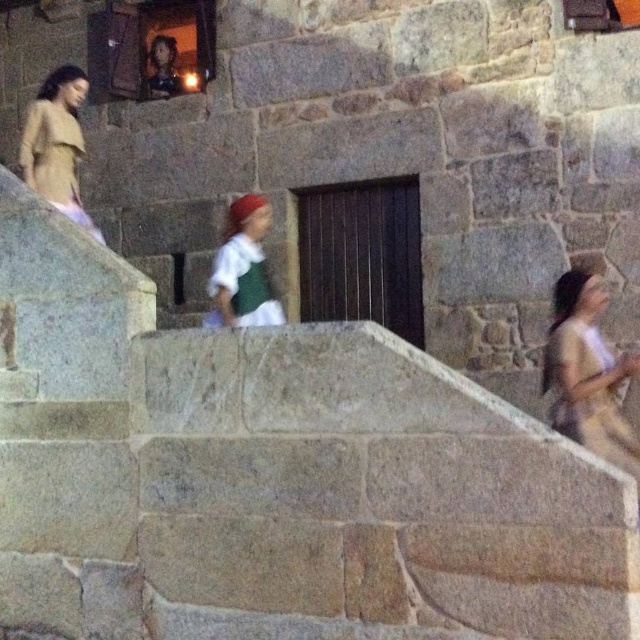
You are standing at the base of the gray stone stairs at center and want to go to the matte beige dress at right. Which direction should you move to reach it?

The matte beige dress at right is behind the gray stone stairs at center, so you should move to the right or around the stairs to reach it.

Consider the image. You are standing at the bottom of the gray stone stairs at center and want to reach the matte beige dress at right. Which direction should you move to get closer to the dress?

To reach the matte beige dress at right from the gray stone stairs at center, you should move to the right since the stairs are positioned to the left of the dress.